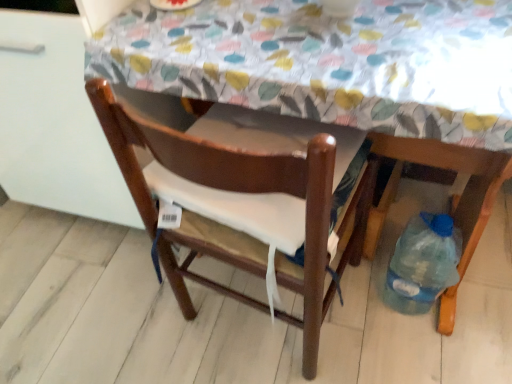
Question: Would you say brown wooden chair at center, which is the 1th chair from left to right, is inside or outside translucent plastic bottle at lower right, which ranks as the first chair in right-to-left order?

Choices:
 (A) inside
 (B) outside

Answer: (B)

Question: Visually, is brown wooden chair at center, which is the 1th chair from left to right, positioned to the left or to the right of translucent plastic bottle at lower right, which appears as the 2th chair when viewed from the left?

Choices:
 (A) right
 (B) left

Answer: (B)

Question: Estimate the real-world distances between objects in this image. Which object is closer to the brown wooden chair at center, which is the 1th chair from left to right?

Choices:
 (A) translucent plastic bottle at lower right, which appears as the 2th chair when viewed from the left
 (B) wooden table at center

Answer: (B)

Question: Which is nearer to the wooden table at center?

Choices:
 (A) brown wooden chair at center, which is the second chair in right-to-left order
 (B) translucent plastic bottle at lower right, which ranks as the first chair in right-to-left order

Answer: (A)